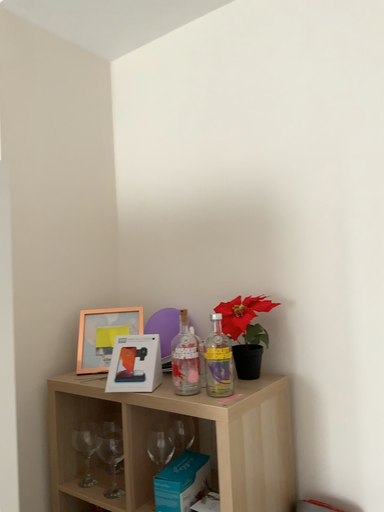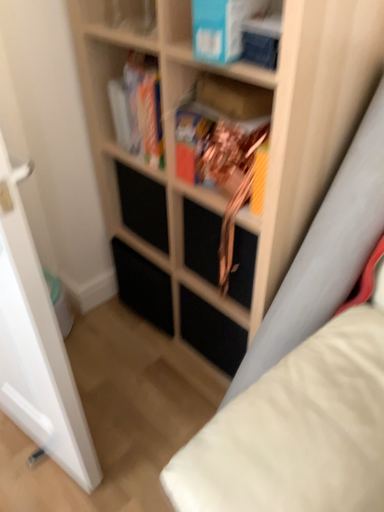
Question: Which way did the camera rotate in the video?

Choices:
 (A) rotated left
 (B) rotated right

Answer: (A)